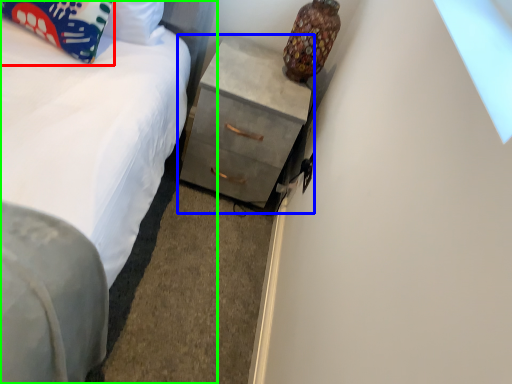
Question: Which object is positioned farthest from pillow (highlighted by a red box)? Select from chest of drawers (highlighted by a blue box) and bed (highlighted by a green box).

Choices:
 (A) chest of drawers
 (B) bed

Answer: (A)